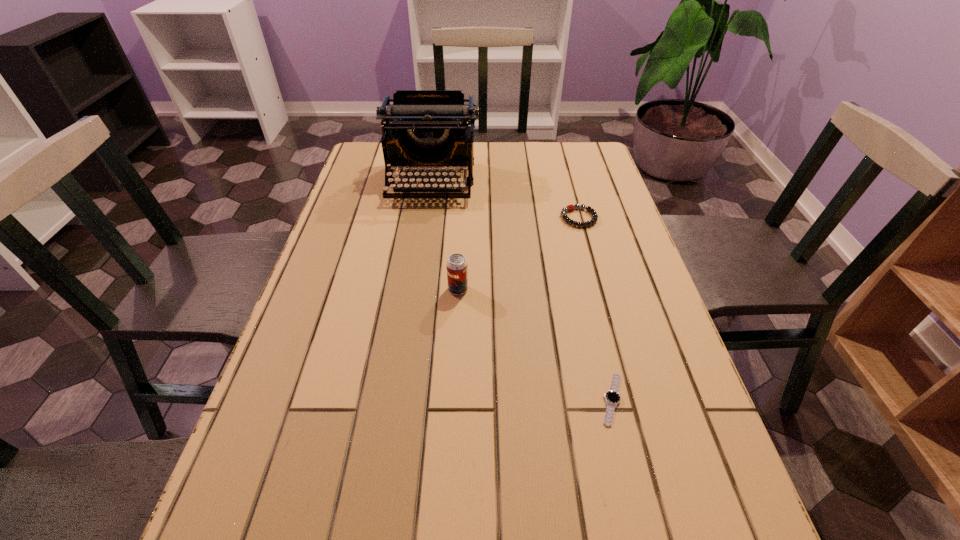
Locate an element on the screen. the tallest object is located at coordinates (422, 128).

The height and width of the screenshot is (540, 960). What are the coordinates of `typewriter` in the screenshot? It's located at (422, 128).

Where is `the second tallest object`? Image resolution: width=960 pixels, height=540 pixels. the second tallest object is located at coordinates (457, 275).

Locate an element on the screen. This screenshot has height=540, width=960. beer can is located at coordinates (457, 275).

Image resolution: width=960 pixels, height=540 pixels. What are the coordinates of `the second farthest object` in the screenshot? It's located at point(570,207).

What are the coordinates of `bracelet` in the screenshot? It's located at (570, 207).

I want to click on watch, so click(612, 397).

This screenshot has height=540, width=960. Find the location of `the nearest object`. the nearest object is located at coordinates pyautogui.click(x=612, y=397).

Locate an element on the screen. The width and height of the screenshot is (960, 540). vacant point located 0.300m on the typing side of the farthest object is located at coordinates (418, 279).

You are a GUI agent. You are given a task and a screenshot of the screen. Output one action in this format:
    pyautogui.click(x=<x>, y=<y>)
    Task: Click on the vacant space situated on the right of the third shortest object
    The height and width of the screenshot is (540, 960).
    Given the screenshot: What is the action you would take?
    pyautogui.click(x=580, y=289)